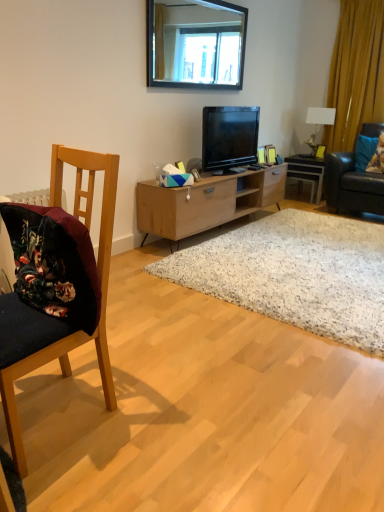
Question: Is velvet dark blue chair at left a part of light wood cabinet at center?

Choices:
 (A) no
 (B) yes

Answer: (A)

Question: Is light wood cabinet at center wider than velvet dark blue chair at left?

Choices:
 (A) yes
 (B) no

Answer: (B)

Question: Can you confirm if light wood cabinet at center is taller than velvet dark blue chair at left?

Choices:
 (A) yes
 (B) no

Answer: (B)

Question: Is light wood cabinet at center with velvet dark blue chair at left?

Choices:
 (A) yes
 (B) no

Answer: (B)

Question: Is light wood cabinet at center shorter than velvet dark blue chair at left?

Choices:
 (A) no
 (B) yes

Answer: (B)

Question: Is light wood cabinet at center in front of velvet dark blue chair at left?

Choices:
 (A) yes
 (B) no

Answer: (B)

Question: Does white speckled rug at center touch black glass mirror at upper center?

Choices:
 (A) no
 (B) yes

Answer: (A)

Question: Is white speckled rug at center far away from black glass mirror at upper center?

Choices:
 (A) no
 (B) yes

Answer: (B)

Question: Considering the relative sizes of white speckled rug at center and black glass mirror at upper center in the image provided, is white speckled rug at center thinner than black glass mirror at upper center?

Choices:
 (A) yes
 (B) no

Answer: (B)

Question: Is white speckled rug at center not within black glass mirror at upper center?

Choices:
 (A) no
 (B) yes

Answer: (B)

Question: Considering the relative sizes of white speckled rug at center and black glass mirror at upper center in the image provided, is white speckled rug at center shorter than black glass mirror at upper center?

Choices:
 (A) yes
 (B) no

Answer: (A)

Question: Does white speckled rug at center have a larger size compared to black glass mirror at upper center?

Choices:
 (A) yes
 (B) no

Answer: (A)

Question: Is blue fabric pillow at right, the 2th pillow viewed from the right, in contact with black glass mirror at upper center?

Choices:
 (A) yes
 (B) no

Answer: (B)